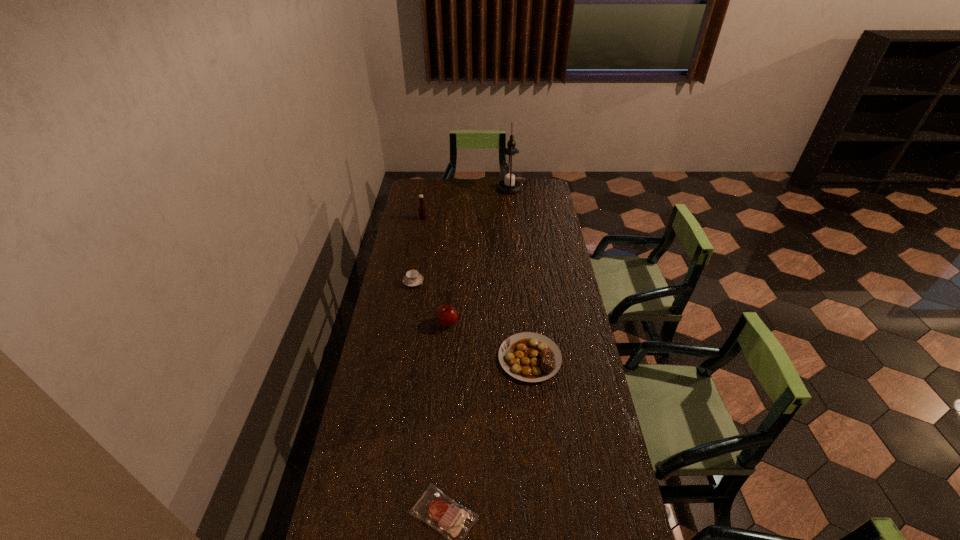
Locate which object is the second closest to the shorter steak. Please provide its 2D coordinates. Your answer should be formatted as a tuple, i.e. [(x, y)], where the tuple contains the x and y coordinates of a point satisfying the conditions above.

[(446, 315)]

Locate an element on the screen. This screenshot has width=960, height=540. vacant space that satisfies the following two spatial constraints: 1. on the back side of the apple; 2. on the right side of the tallest object is located at coordinates (457, 188).

Image resolution: width=960 pixels, height=540 pixels. In order to click on free point that satisfies the following two spatial constraints: 1. on the back side of the fifth nearest object; 2. on the left side of the farthest object in this screenshot , I will do `click(428, 188)`.

The width and height of the screenshot is (960, 540). I want to click on free region that satisfies the following two spatial constraints: 1. on the side with the handle of the fourth nearest object; 2. on the left side of the oil lamp, so click(x=429, y=188).

Locate an element on the screen. Image resolution: width=960 pixels, height=540 pixels. vacant region that satisfies the following two spatial constraints: 1. on the front side of the taller steak; 2. on the left side of the Tabasco sauce is located at coordinates (398, 358).